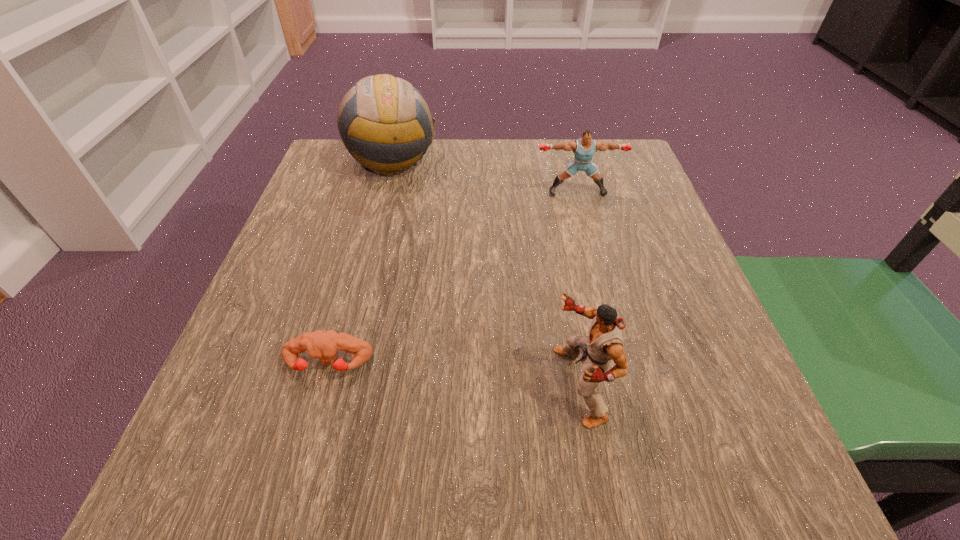
The image size is (960, 540). Find the location of `vacant region located 0.350m on the front-facing side of the third nearest object`. vacant region located 0.350m on the front-facing side of the third nearest object is located at coordinates (612, 325).

Where is `free space located with the gloves of the leftmost puncher facing forward`? This screenshot has width=960, height=540. free space located with the gloves of the leftmost puncher facing forward is located at coordinates (300, 463).

I want to click on volleyball present at the far edge, so click(x=384, y=122).

Find the location of a particular element. puncher positioned at the far edge is located at coordinates (584, 148).

You are a GUI agent. You are given a task and a screenshot of the screen. Output one action in this format:
    pyautogui.click(x=<x>, y=<y>)
    Task: Click on the volleyball that is at the left edge
    
    Given the screenshot: What is the action you would take?
    click(384, 122)

What are the coordinates of `puncher at the left edge` in the screenshot? It's located at (319, 344).

You are a GUI agent. You are given a task and a screenshot of the screen. Output one action in this format:
    pyautogui.click(x=<x>, y=<y>)
    Task: Click on the object at the right edge
    
    Given the screenshot: What is the action you would take?
    pyautogui.click(x=584, y=148)

Where is `object that is at the far left corner`? object that is at the far left corner is located at coordinates (384, 122).

This screenshot has height=540, width=960. Find the location of `object that is at the far right corner`. object that is at the far right corner is located at coordinates (584, 148).

Locate an element on the screen. The height and width of the screenshot is (540, 960). free spot at the far edge of the desktop is located at coordinates (548, 191).